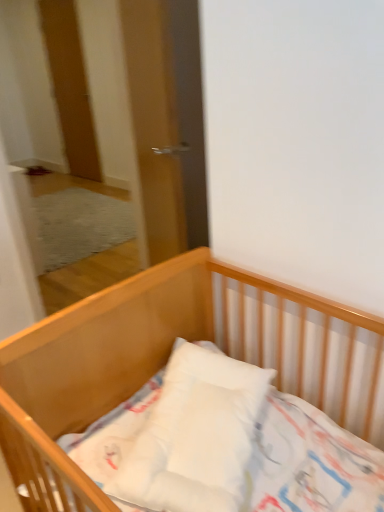
Find the location of a particular element. This screenshot has width=384, height=512. wooden door at upper left is located at coordinates (70, 86).

This screenshot has width=384, height=512. Describe the element at coordinates (167, 359) in the screenshot. I see `wooden crib at center` at that location.

Find the location of a particular element. wooden door at upper left is located at coordinates (70, 86).

Between transparent glass door at center and wooden door at upper left, which one has larger width?

transparent glass door at center is wider.

Considering the relative sizes of transparent glass door at center and wooden door at upper left in the image provided, is transparent glass door at center smaller than wooden door at upper left?

No, transparent glass door at center is not smaller than wooden door at upper left.

Between transparent glass door at center and wooden door at upper left, which one has more height?

wooden door at upper left.

From the image's perspective, would you say transparent glass door at center is positioned over wooden door at upper left?

No, from the image's perspective, transparent glass door at center is not over wooden door at upper left.

How different are the orientations of wooden crib at center and wooden door at upper left in degrees?

The angular difference between wooden crib at center and wooden door at upper left is 0.00204 degrees.

Considering the sizes of objects wooden crib at center and wooden door at upper left in the image provided, who is taller, wooden crib at center or wooden door at upper left?

Standing taller between the two is wooden door at upper left.

Is wooden crib at center inside or outside of wooden door at upper left?

wooden crib at center is spatially situated outside wooden door at upper left.

Does wooden door at upper left turn towards wooden crib at center?

No, wooden door at upper left is not aimed at wooden crib at center.

Considering the sizes of objects wooden door at upper left and wooden crib at center in the image provided, who is shorter, wooden door at upper left or wooden crib at center?

Standing shorter between the two is wooden crib at center.

Does wooden door at upper left come in front of wooden crib at center?

No, wooden door at upper left is behind wooden crib at center.

From the image's perspective, is transparent glass door at center located above or below wooden crib at center?

From the image's perspective, transparent glass door at center appears above wooden crib at center.

From their relative heights in the image, would you say transparent glass door at center is taller or shorter than wooden crib at center?

transparent glass door at center is taller than wooden crib at center.

Based on their sizes in the image, would you say transparent glass door at center is bigger or smaller than wooden crib at center?

In the image, transparent glass door at center appears to be smaller than wooden crib at center.

Is wooden crib at center surrounded by transparent glass door at center?

No, wooden crib at center is not a part of transparent glass door at center.

Between wooden door at upper left and transparent glass door at center, which one has larger width?

transparent glass door at center is wider.

From a real-world perspective, which object rests below the other?

In real-world perspective, transparent glass door at center is lower.

Based on the photo, looking at the image, does wooden door at upper left seem bigger or smaller compared to transparent glass door at center?

Considering their sizes, wooden door at upper left takes up less space than transparent glass door at center.

Which object is positioned more to the left, wooden crib at center or transparent glass door at center?

transparent glass door at center.

Choose the correct answer: Is wooden crib at center inside transparent glass door at center or outside it?

wooden crib at center is not inside transparent glass door at center, it's outside.

Considering the sizes of wooden crib at center and transparent glass door at center in the image, is wooden crib at center wider or thinner than transparent glass door at center?

wooden crib at center is wider than transparent glass door at center.

From a real-world perspective, who is located lower, wooden crib at center or transparent glass door at center?

wooden crib at center, from a real-world perspective.

The image size is (384, 512). In the image, there is a wooden door at upper left. What are the coordinates of `screen door below it (from a real-world perspective)` in the screenshot? It's located at (167, 122).

You are a GUI agent. You are given a task and a screenshot of the screen. Output one action in this format:
    pyautogui.click(x=<x>, y=<y>)
    Task: Click on the door behind the wooden crib at center
    
    Given the screenshot: What is the action you would take?
    pyautogui.click(x=70, y=86)

From the image, which object appears to be farther from wooden crib at center, wooden door at upper left or transparent glass door at center?

The object further to wooden crib at center is wooden door at upper left.

Based on their spatial positions, is wooden crib at center or transparent glass door at center closer to wooden door at upper left?

Among the two, transparent glass door at center is located nearer to wooden door at upper left.

From the image, which object appears to be nearer to transparent glass door at center, wooden crib at center or wooden door at upper left?

Among the two, wooden crib at center is located nearer to transparent glass door at center.

Estimate the real-world distances between objects in this image. Which object is closer to wooden door at upper left, transparent glass door at center or wooden crib at center?

Based on the image, transparent glass door at center appears to be nearer to wooden door at upper left.

Based on their spatial positions, is wooden door at upper left or wooden crib at center closer to transparent glass door at center?

The object closer to transparent glass door at center is wooden crib at center.

Based on their spatial positions, is transparent glass door at center or wooden door at upper left further from wooden crib at center?

wooden door at upper left.

I want to click on screen door positioned between wooden crib at center and wooden door at upper left from near to far, so click(167, 122).